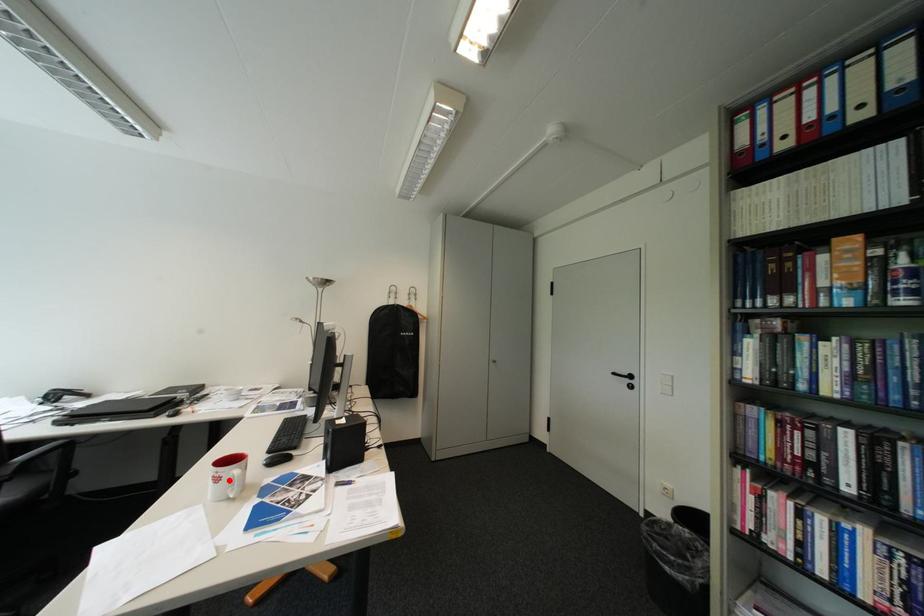
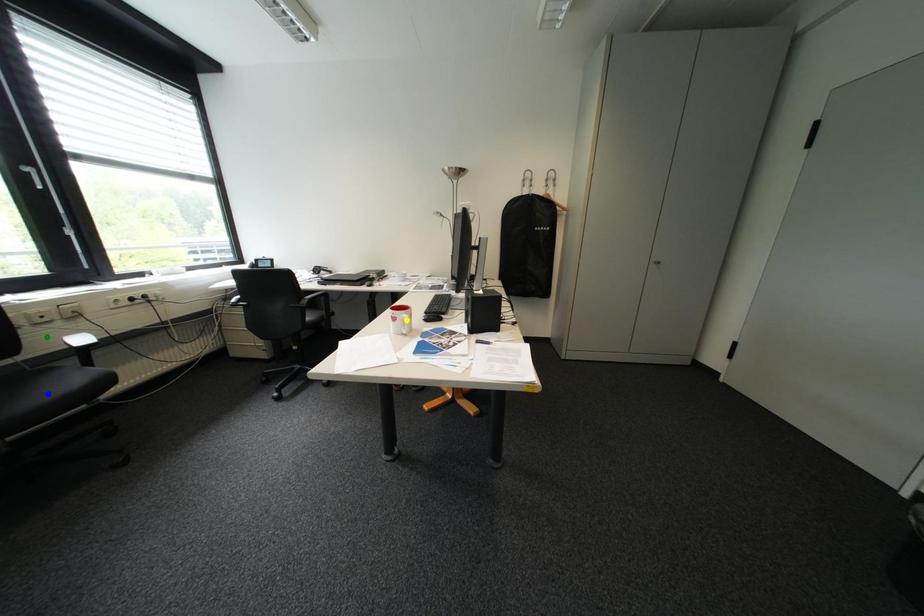
Question: I am providing you with two images of the same scene from different viewpoints. A red point is marked on the first image. You are given multiple points on the second image. Which point in image 2 represents the same 3d spot as the red point in image 1?

Choices:
 (A) yellow point
 (B) blue point
 (C) green point

Answer: (A)